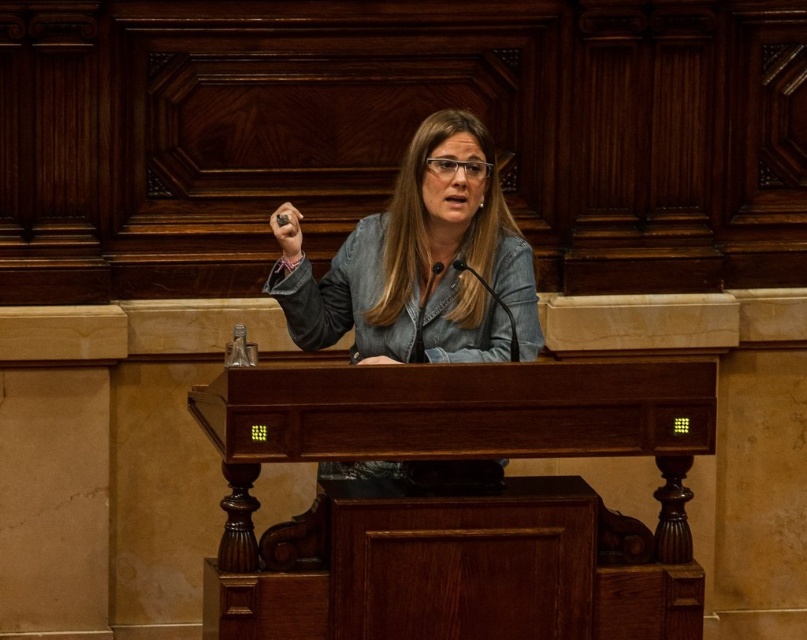
Question: Is wooden podium at center thinner than black plastic microphone at center?

Choices:
 (A) no
 (B) yes

Answer: (A)

Question: Which point appears closest to the camera in this image?

Choices:
 (A) (408, 269)
 (B) (642, 554)

Answer: (B)

Question: Does denim jacket at center appear over black plastic microphone at center?

Choices:
 (A) no
 (B) yes

Answer: (B)

Question: Is denim jacket at center to the right of black plastic microphone at center from the viewer's perspective?

Choices:
 (A) yes
 (B) no

Answer: (B)

Question: Which is farther from the wooden podium at center?

Choices:
 (A) denim jacket at center
 (B) black plastic microphone at center

Answer: (B)

Question: Which point is closer to the camera?

Choices:
 (A) (433, 580)
 (B) (511, 349)
 (C) (486, 131)

Answer: (A)